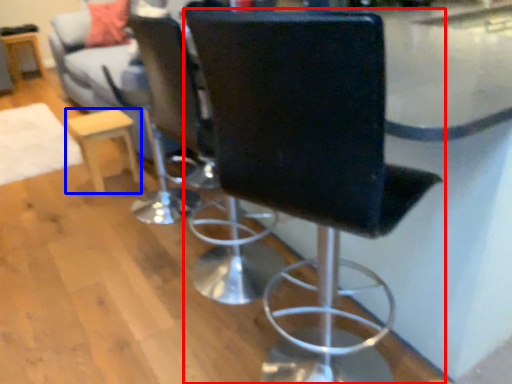
Question: Which object is closer to the camera taking this photo, chair (highlighted by a red box) or furniture (highlighted by a blue box)?

Choices:
 (A) chair
 (B) furniture

Answer: (A)